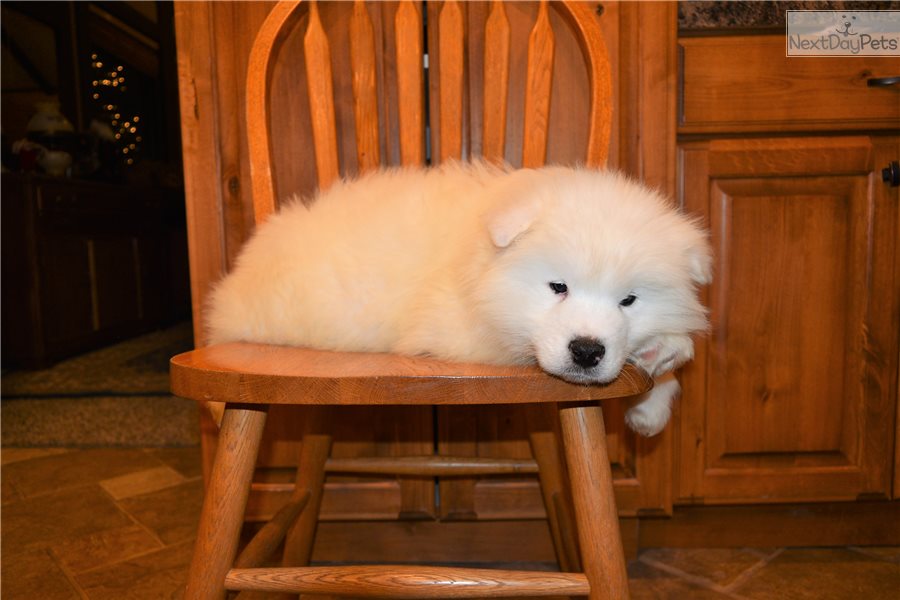
I want to click on drawer, so click(x=783, y=92).